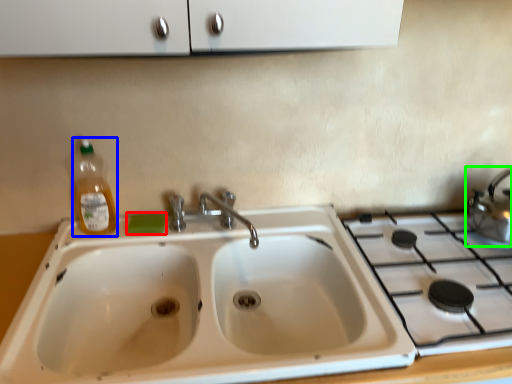
Question: Which is farther away from soap (highlighted by a red box)? bottle (highlighted by a blue box) or tea pot (highlighted by a green box)?

Choices:
 (A) bottle
 (B) tea pot

Answer: (B)